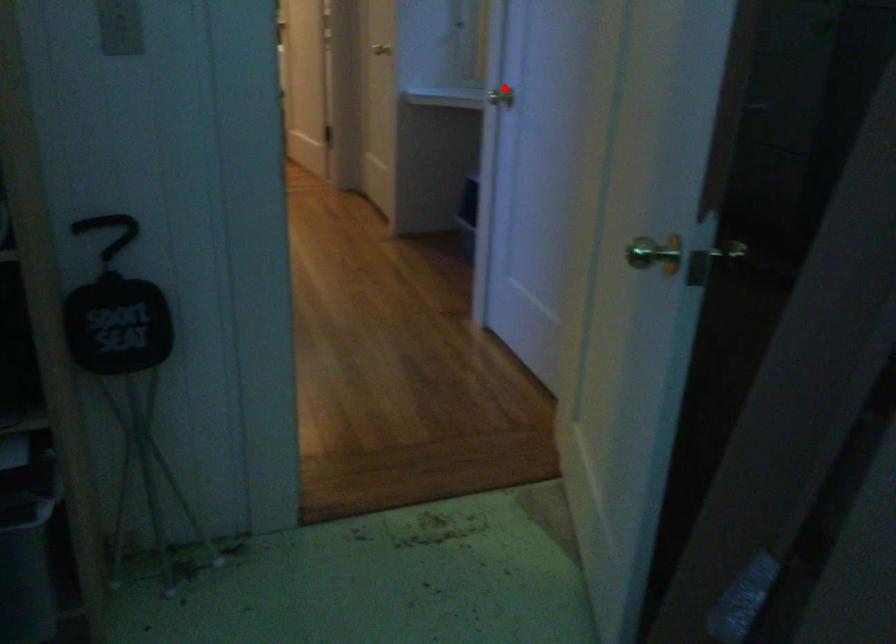
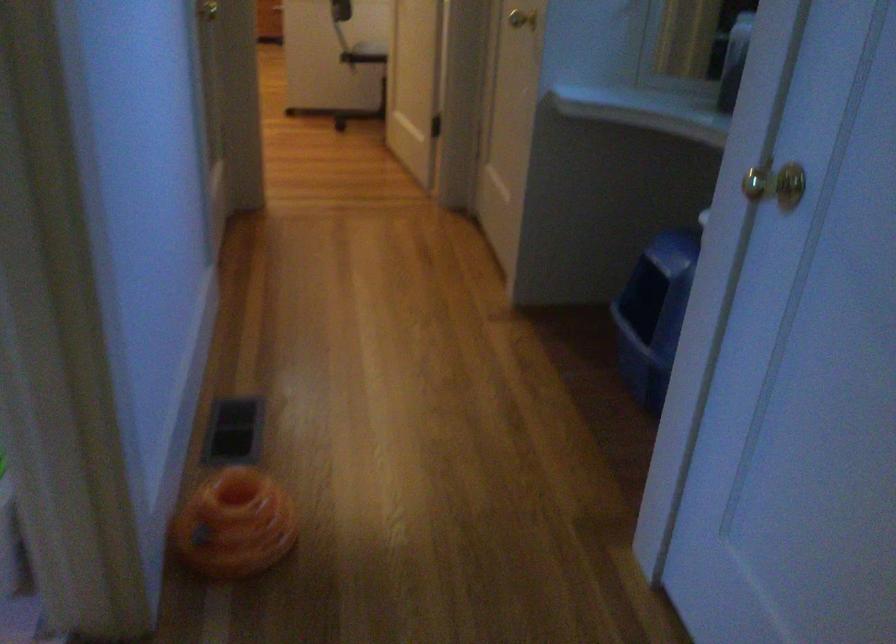
Question: I am providing you with two images of the same scene from different viewpoints. A red point is marked on the first image. Can you still see the location of the red point in image 2?

Choices:
 (A) Yes
 (B) No

Answer: (A)